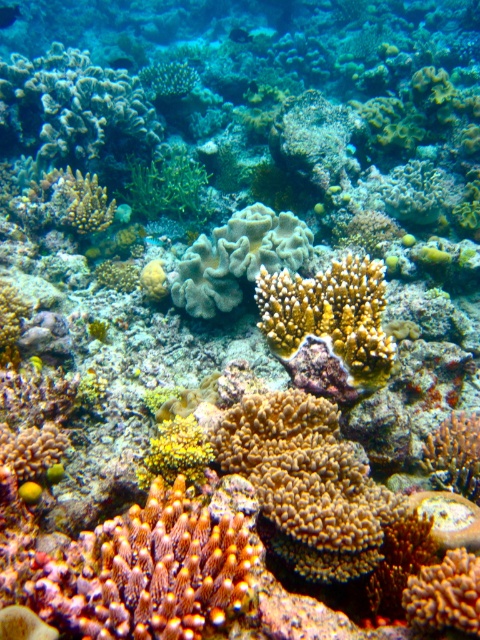
You are a marine biologist studying coral reefs. You observe two corals in the image, the yellow coral at center and the smooth gray coral at center. Which coral is taller?

The smooth gray coral at center is taller than the yellow coral at center.

You are a scuba diver swimming in the coral reef. You see two points marked in the image. The first point is at coordinates point [179,540] and the second point is at point [382,349]. If you want to reach the point that is closer to you, which coordinate should you swim towards?

You should swim towards point [179,540] because it is in front of point [382,349], meaning it is closer to your current position.